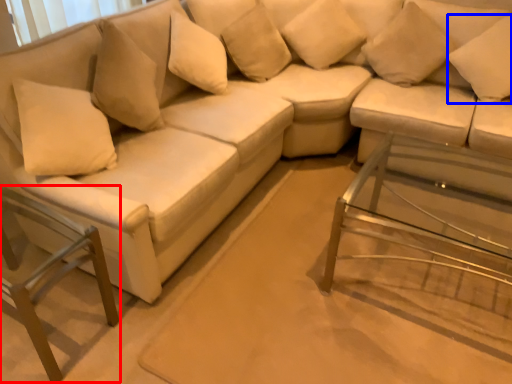
Question: Which of the following is the farthest to the observer, swivel chair (highlighted by a red box) or pillow (highlighted by a blue box)?

Choices:
 (A) swivel chair
 (B) pillow

Answer: (B)